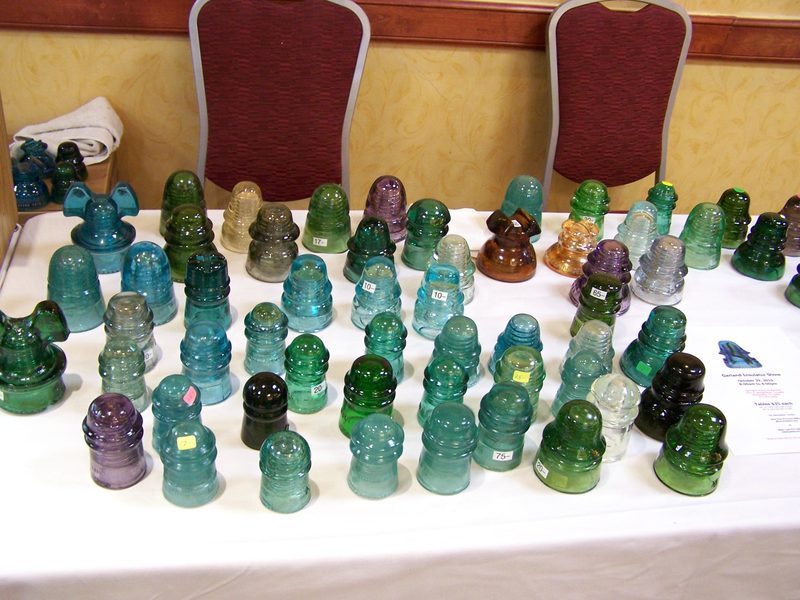
Find the location of `chair`. chair is located at coordinates (310, 98).